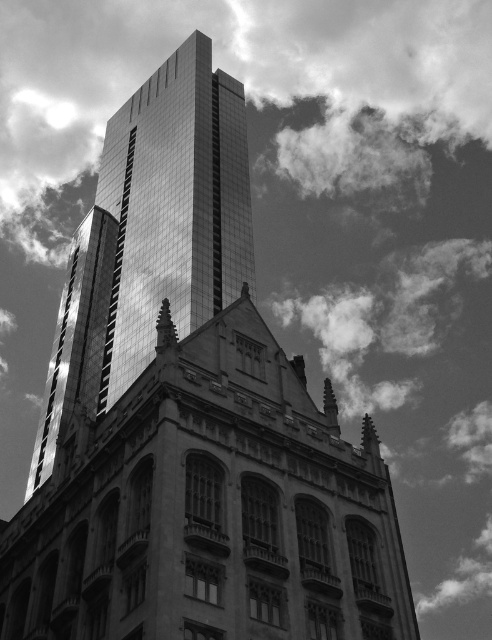
Question: Can you confirm if reflective glass skyscraper at center is positioned above smooth glass spire at center?

Choices:
 (A) yes
 (B) no

Answer: (A)

Question: Which point is closer to the camera taking this photo?

Choices:
 (A) (176, 333)
 (B) (237, 204)

Answer: (A)

Question: Which object appears closest to the camera in this image?

Choices:
 (A) reflective glass skyscraper at center
 (B) smooth glass spire at center

Answer: (B)

Question: Does reflective glass skyscraper at center have a lesser width compared to smooth glass spire at center?

Choices:
 (A) yes
 (B) no

Answer: (B)

Question: Is reflective glass skyscraper at center further to the viewer compared to smooth glass spire at center?

Choices:
 (A) no
 (B) yes

Answer: (B)